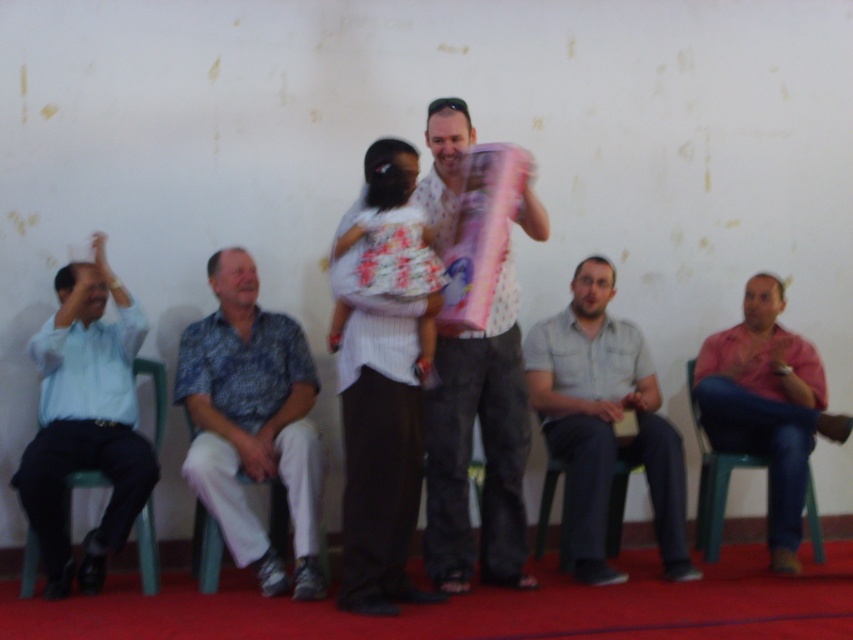
You are a photographer setting up for a group photo. You notice the floral fabric dress at center and the green plastic chair at lower center. Which object is closer to the camera?

The floral fabric dress at center is in front of the green plastic chair at lower center, so it is closer to the camera.

You are a photographer taking a picture of the scene. You notice the floral fabric dress at center and the light blue shirt at left. Which one should you focus on first to ensure it is in clear view?

The floral fabric dress at center should be focused on first because it is closer to the viewer than the light blue shirt at left, so it will appear larger and more prominent in the photo.

Based on the scene description, which object is smaller in size between the light blue shirt at left and the gray cotton shirt at center?

The light blue shirt at left is smaller in size compared to the gray cotton shirt at center.